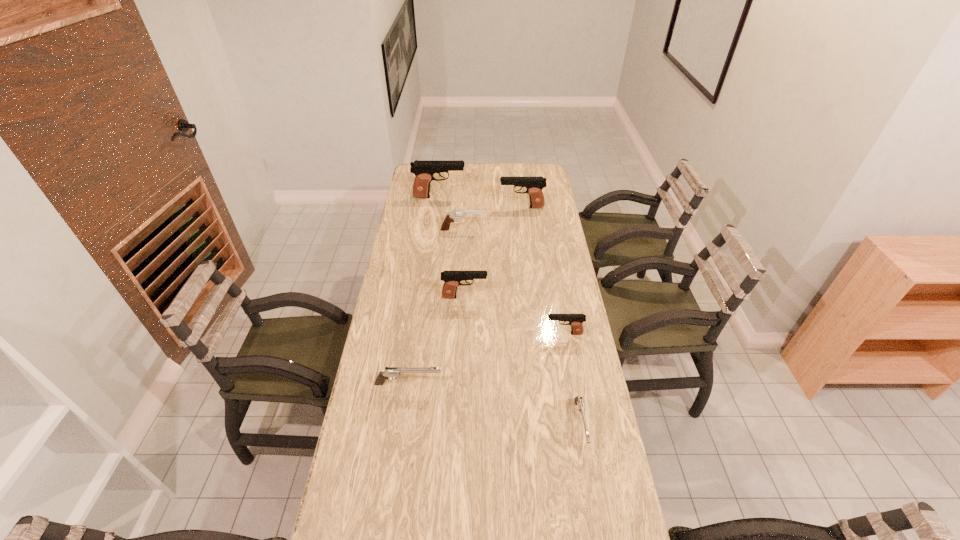
You are a GUI agent. You are given a task and a screenshot of the screen. Output one action in this format:
    pyautogui.click(x=<x>, y=<y>)
    Task: Click on the farthest object
    This screenshot has width=960, height=540.
    Given the screenshot: What is the action you would take?
    pyautogui.click(x=424, y=170)

Find the location of a particular element. the tallest object is located at coordinates click(424, 170).

Where is `the second tallest object`? The height and width of the screenshot is (540, 960). the second tallest object is located at coordinates (534, 185).

Locate an element on the screen. the second biggest black pistol is located at coordinates (534, 185).

Where is `the third tallest object`? The image size is (960, 540). the third tallest object is located at coordinates pyautogui.click(x=452, y=279).

You are a GUI agent. You are given a task and a screenshot of the screen. Output one action in this format:
    pyautogui.click(x=<x>, y=<y>)
    Task: Click on the third tallest pistol
    This screenshot has height=540, width=960.
    Given the screenshot: What is the action you would take?
    pyautogui.click(x=452, y=279)

Locate an element on the screen. This screenshot has height=540, width=960. gun is located at coordinates (456, 213).

This screenshot has height=540, width=960. I want to click on the nearest black pistol, so click(575, 321).

Locate an element on the screen. This screenshot has width=960, height=540. the smallest black pistol is located at coordinates click(x=575, y=321).

In order to click on the farther silver pistol in this screenshot , I will do `click(389, 372)`.